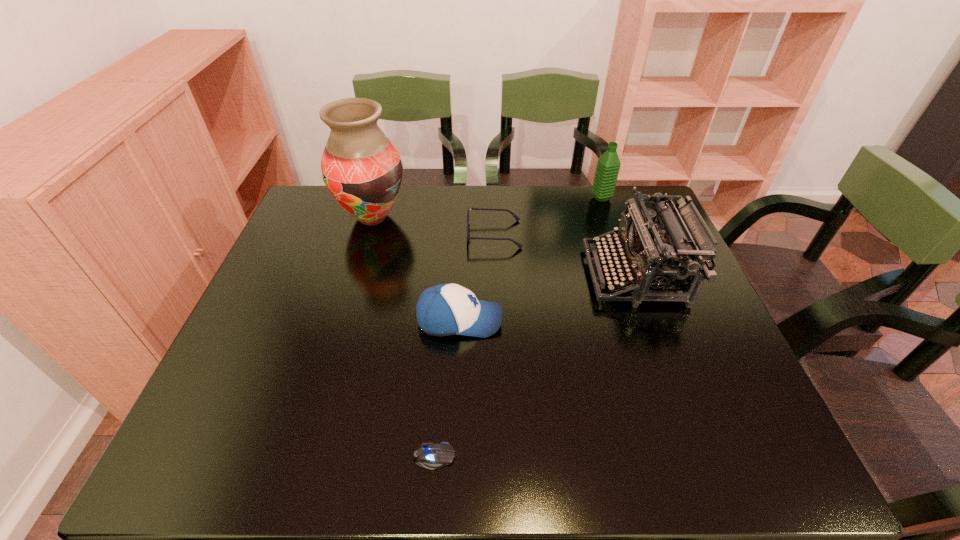
Where is `spectacles that is at the far edge`? spectacles that is at the far edge is located at coordinates (516, 217).

Locate an element on the screen. object positioned at the near edge is located at coordinates (430, 456).

The image size is (960, 540). Find the location of `object present at the left edge`. object present at the left edge is located at coordinates (361, 168).

Where is `water bottle present at the right edge`? This screenshot has height=540, width=960. water bottle present at the right edge is located at coordinates (608, 165).

The width and height of the screenshot is (960, 540). Identify the location of typewriter at the right edge. (657, 259).

Image resolution: width=960 pixels, height=540 pixels. I want to click on object present at the far left corner, so click(x=361, y=168).

Locate an element on the screen. The image size is (960, 540). object present at the far right corner is located at coordinates (608, 165).

You are a GUI agent. You are given a task and a screenshot of the screen. Output one action in this format:
    pyautogui.click(x=<x>, y=<y>)
    Task: Click on the free space at the far edge of the desktop
    The image size is (960, 540).
    Given the screenshot: What is the action you would take?
    pyautogui.click(x=535, y=191)

This screenshot has width=960, height=540. In the image, there is a desktop. Identify the location of free space at the near edge. (541, 434).

In the image, there is a desktop. At what (x,y) coordinates should I click in order to perform the action: click on free space at the left edge. Please return your answer as a coordinate pair (x, y). Looking at the image, I should click on coord(227,373).